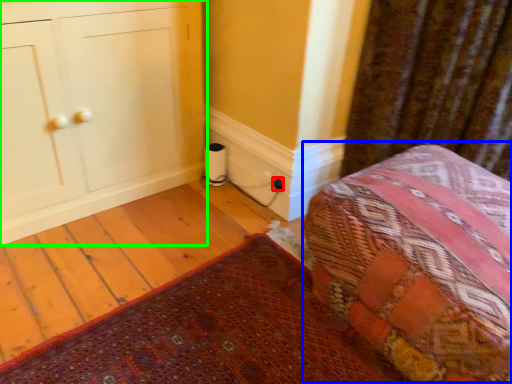
Question: Which object is positioned farthest from electric outlet (highlighted by a red box)? Select from bed (highlighted by a blue box) and furniture (highlighted by a green box).

Choices:
 (A) bed
 (B) furniture

Answer: (A)